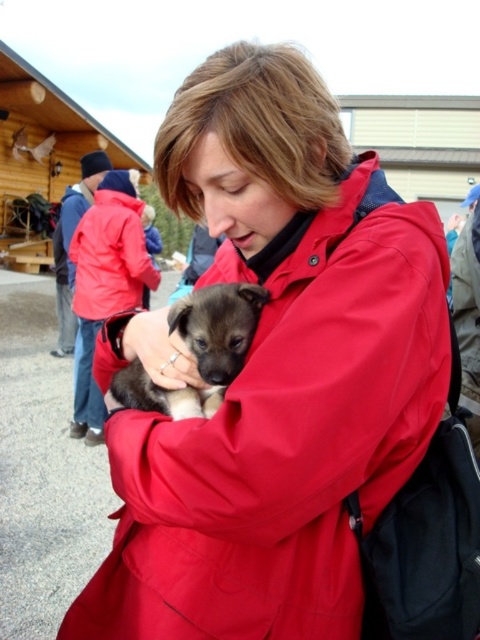
Consider the image. Is brown fur puppy at center positioned behind matte red trench coat at center?

No.

Is brown fur puppy at center above matte red trench coat at center?

No, brown fur puppy at center is not above matte red trench coat at center.

Does point (200, 401) come in front of point (472, 305)?

Yes.

Find the location of `brown fur puppy at center`. brown fur puppy at center is located at coordinates 199,349.

Is brown fur puppy at center to the right of matte red jacket at upper left from the viewer's perspective?

Indeed, brown fur puppy at center is positioned on the right side of matte red jacket at upper left.

Where is `brown fur puppy at center`? The height and width of the screenshot is (640, 480). brown fur puppy at center is located at coordinates (199, 349).

What do you see at coordinates (199, 349) in the screenshot? I see `brown fur puppy at center` at bounding box center [199, 349].

The image size is (480, 640). I want to click on brown fur puppy at center, so click(199, 349).

Can you confirm if matte red jacket at upper left is bigger than matte red trench coat at center?

No.

Who is more distant from viewer, (81, 316) or (470, 330)?

The point (81, 316) is behind.

The width and height of the screenshot is (480, 640). Identify the location of matte red jacket at upper left. (110, 257).

Locate an element on the screen. This screenshot has width=480, height=640. matte red jacket at upper left is located at coordinates (110, 257).